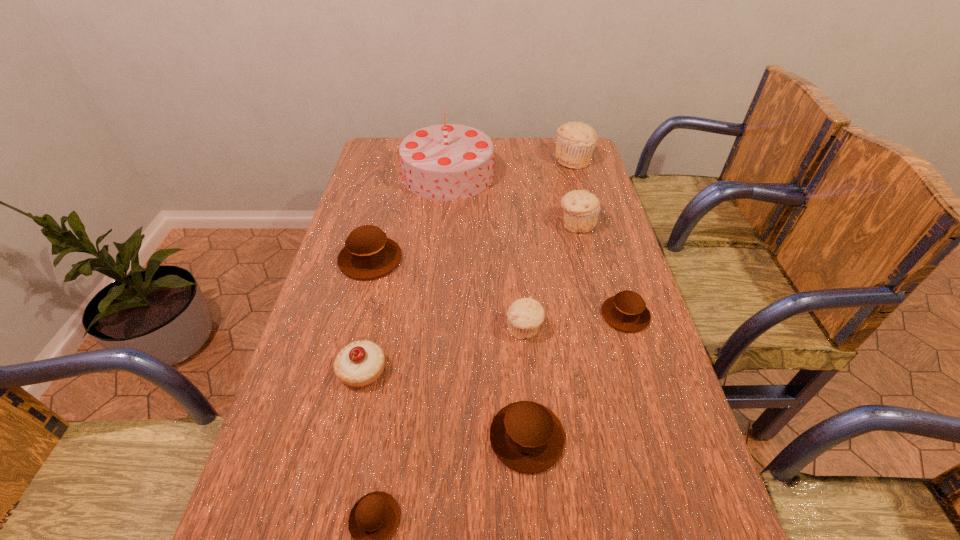
Where is `vacant region at the far edge of the desktop`? The width and height of the screenshot is (960, 540). vacant region at the far edge of the desktop is located at coordinates (508, 146).

You are a GUI agent. You are given a task and a screenshot of the screen. Output one action in this format:
    pyautogui.click(x=<x>, y=<y>)
    Task: Click on the free space at the left edge of the desktop
    The width and height of the screenshot is (960, 540).
    Given the screenshot: What is the action you would take?
    pyautogui.click(x=386, y=172)

You are a GUI agent. You are given a task and a screenshot of the screen. Output one action in this format:
    pyautogui.click(x=<x>, y=<y>)
    Task: Click on the vacant space at the right edge
    The image size is (960, 540).
    Given the screenshot: What is the action you would take?
    pyautogui.click(x=567, y=174)

Locate an element on the screen. The image size is (960, 540). empty space that is in between the second shortest object and the tallest muffin is located at coordinates (599, 238).

The image size is (960, 540). In order to click on vacant space that's between the farthest brown muffin and the pastry in this screenshot , I will do `click(367, 315)`.

The image size is (960, 540). I want to click on vacant space that's between the rightmost brown muffin and the nearest beige muffin, so click(x=575, y=322).

Find the location of a particular element. This screenshot has width=960, height=540. vacant space that's between the pastry and the second nearest object is located at coordinates (444, 404).

You are a GUI agent. You are given a task and a screenshot of the screen. Output one action in this format:
    pyautogui.click(x=<x>, y=<y>)
    Task: Click on the free spot between the tallest object and the nearest beige muffin
    This screenshot has width=960, height=540.
    Given the screenshot: What is the action you would take?
    pyautogui.click(x=486, y=252)

You are a GUI agent. You are given a task and a screenshot of the screen. Output one action in this format:
    pyautogui.click(x=<x>, y=<y>)
    Task: Click on the unoccupied position between the second farthest muffin and the beige pastry
    
    Given the screenshot: What is the action you would take?
    pyautogui.click(x=469, y=298)

Where is `unoccupied area between the rightmost brown muffin and the pastry`? The height and width of the screenshot is (540, 960). unoccupied area between the rightmost brown muffin and the pastry is located at coordinates (493, 343).